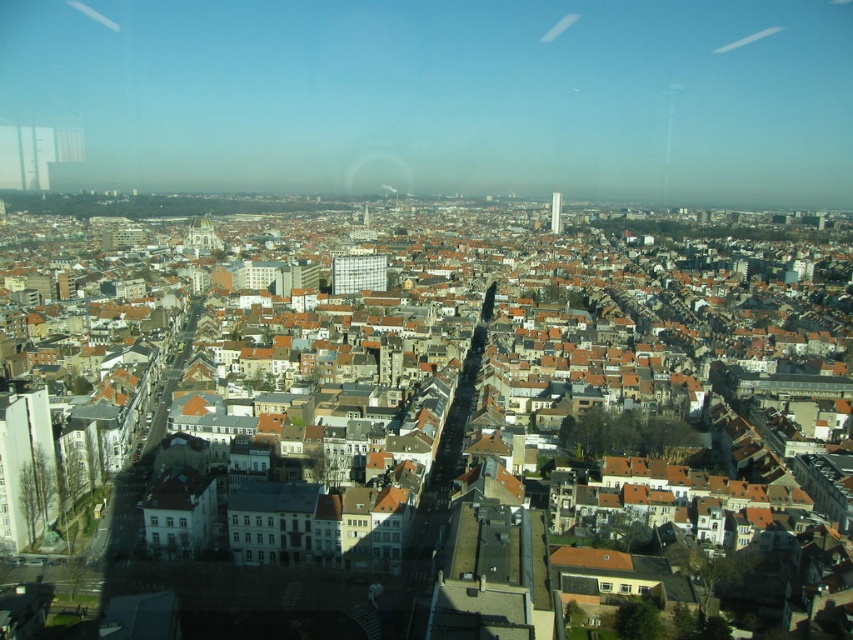
From the picture: You are a drone operator trying to deliver a package to the white glass tower at center. Your GPS shows that the tower is at point (555, 212). You see the white glass tower at center in the image. Is the tower at the correct GPS coordinates?

Yes, the white glass tower at center is located at point (555, 212), so the GPS coordinates are correct.